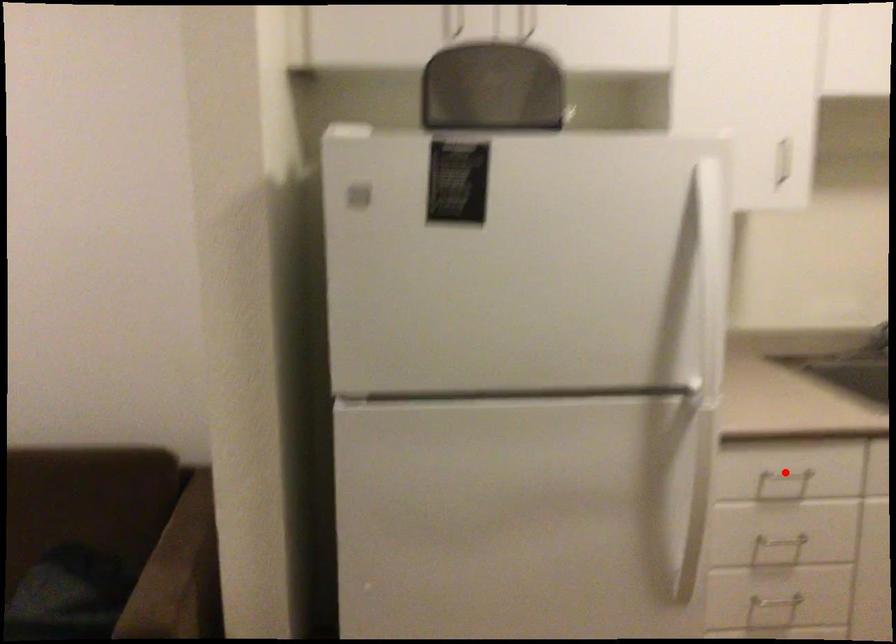
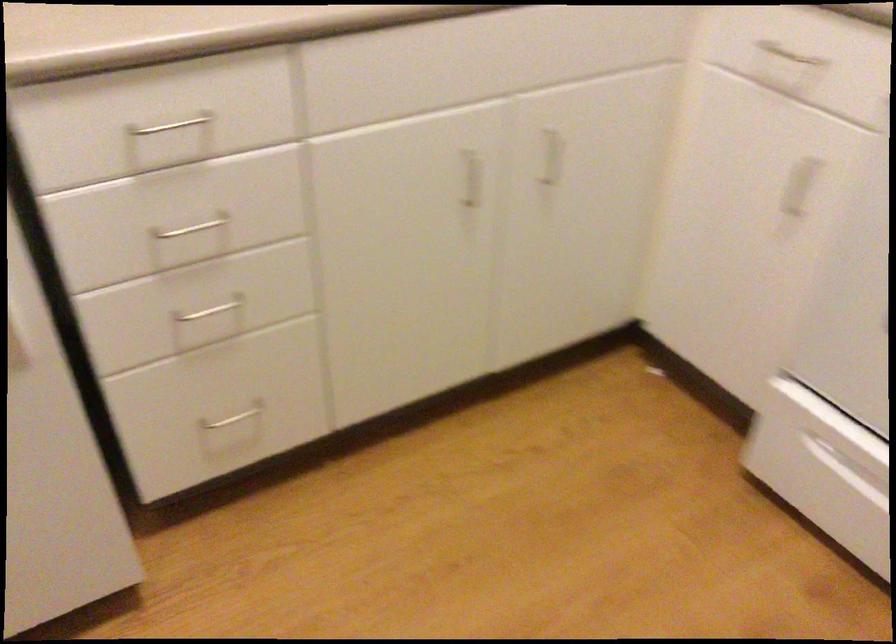
In the second image, find the point that corresponds to the highlighted location in the first image.

(170, 125)